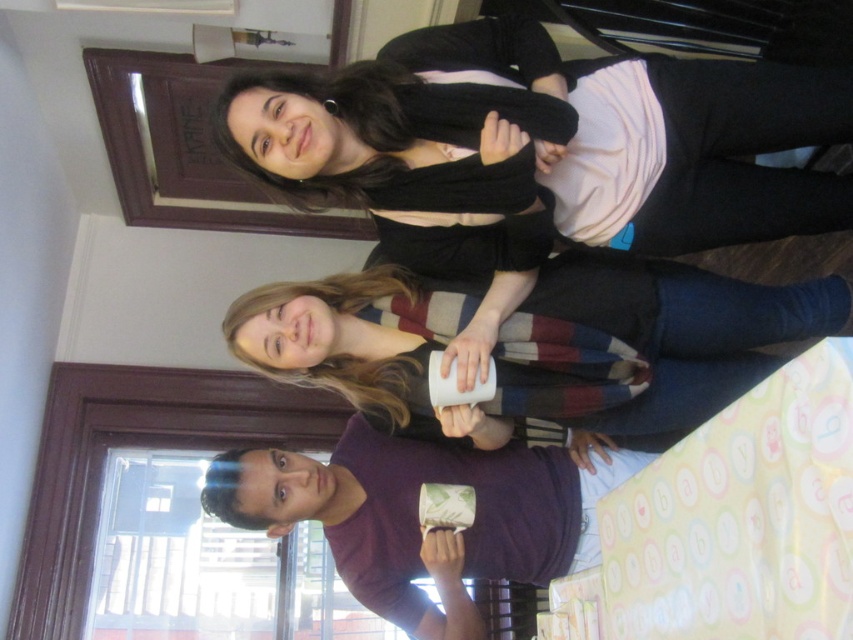
You are standing in the room and want to move from point A to point B. Point A is at coordinates point (x=839, y=93) and point B is at coordinates point (x=439, y=625). Which point is closer to you?

Point (x=839, y=93) is closer to the viewer than point (x=439, y=625).

You are standing in the room and want to hand a gift to the person holding the white matte mug at center. Where should you walk to in order to reach them?

You should walk towards the white matte mug at center located at point (659, 355) to reach the person holding it.

You are a photographer standing at the camera position. You want to take a closeup photo of the white matte mug at center. Is it possible to focus on the mug without moving the camera or the mug?

The white matte mug at center is 1.70 meters from camera. Since the mug is within a typical focusing range of most cameras, it is possible to focus on the mug without moving the camera or the mug.